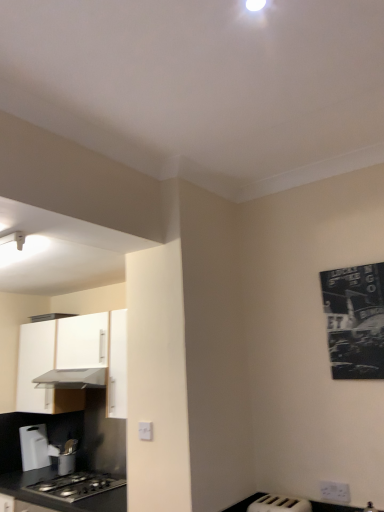
What do you see at coordinates (72, 379) in the screenshot? I see `metallic gray exhaust hood at left` at bounding box center [72, 379].

Find the location of `metallic gray exhaust hood at left`. metallic gray exhaust hood at left is located at coordinates (72, 379).

The image size is (384, 512). Describe the element at coordinates (72, 361) in the screenshot. I see `white matte cabinet at left` at that location.

Identify the location of white plastic cutting board at lower left. The image size is (384, 512). (34, 447).

The height and width of the screenshot is (512, 384). In order to click on metallic silver utensil holder at lower left, the second appliance when ordered from top to bottom in this screenshot , I will do `click(65, 456)`.

Where is `white plastic toaster at lower right, the 1th appliance viewed from the top`? This screenshot has height=512, width=384. white plastic toaster at lower right, the 1th appliance viewed from the top is located at coordinates (279, 504).

What is the approximate height of black paper poster at upper right?

black paper poster at upper right is 60.69 centimeters in height.

The height and width of the screenshot is (512, 384). Find the location of `black matte countertop at lower left`. black matte countertop at lower left is located at coordinates (61, 499).

Is white plastic electric outlet at lower center, arranged as the 1th electric outlet when viewed from the top, wider than white plastic toaster at lower right, the 2th appliance when ordered from bottom to top?

In fact, white plastic electric outlet at lower center, arranged as the 1th electric outlet when viewed from the top, might be narrower than white plastic toaster at lower right, the 2th appliance when ordered from bottom to top.

From a real-world perspective, count 2nd appliances downward from the white plastic electric outlet at lower center, positioned as the 1th electric outlet in left-to-right order, and point to it. Please provide its 2D coordinates.

[(279, 504)]

Does white plastic electric outlet at lower center, positioned as the 1th electric outlet in left-to-right order, turn towards white plastic toaster at lower right, the first appliance positioned from the front?

No, white plastic electric outlet at lower center, positioned as the 1th electric outlet in left-to-right order, is not turned towards white plastic toaster at lower right, the first appliance positioned from the front.

From a real-world perspective, is black matte countertop at lower left above or below black paper poster at upper right?

black matte countertop at lower left is below black paper poster at upper right.

Does black matte countertop at lower left turn towards black paper poster at upper right?

No, black matte countertop at lower left does not turn towards black paper poster at upper right.

Looking at this image, from the image's perspective, is black matte countertop at lower left positioned above or below black paper poster at upper right?

Based on their image positions, black matte countertop at lower left is located beneath black paper poster at upper right.

Which of these two, black matte countertop at lower left or black paper poster at upper right, is smaller?

black paper poster at upper right is smaller.

Is black matte countertop at lower left turned away from metallic gray exhaust hood at left?

black matte countertop at lower left is not turned away from metallic gray exhaust hood at left.

Is point (72, 509) behind point (104, 369)?

That is False.

You are a GUI agent. You are given a task and a screenshot of the screen. Output one action in this format:
    pyautogui.click(x=<x>, y=<y>)
    Task: Click on the exhaust hood lying above the black matte countertop at lower left (from the image's perspective)
    The height and width of the screenshot is (512, 384).
    Given the screenshot: What is the action you would take?
    pyautogui.click(x=72, y=379)

Based on the photo, does black matte countertop at lower left have a greater width compared to metallic gray exhaust hood at left?

Correct, the width of black matte countertop at lower left exceeds that of metallic gray exhaust hood at left.

In the image, is white plastic cutting board at lower left on the left side or the right side of white plastic electric outlet at lower center, which ranks as the 2th electric outlet in right-to-left order?

From the image, it's evident that white plastic cutting board at lower left is to the left of white plastic electric outlet at lower center, which ranks as the 2th electric outlet in right-to-left order.

Is white plastic cutting board at lower left taller or shorter than white plastic electric outlet at lower center, arranged as the 1th electric outlet when viewed from the top?

Considering their sizes, white plastic cutting board at lower left has more height than white plastic electric outlet at lower center, arranged as the 1th electric outlet when viewed from the top.

From the image's perspective, is white plastic cutting board at lower left positioned above or below white plastic electric outlet at lower center, arranged as the 1th electric outlet when viewed from the top?

white plastic cutting board at lower left is below white plastic electric outlet at lower center, arranged as the 1th electric outlet when viewed from the top.

Does point (70, 464) come farther from viewer compared to point (89, 316)?

Yes, it is behind point (89, 316).

Does metallic silver utensil holder at lower left, which ranks as the first appliance in back-to-front order, have a larger size compared to white matte cabinet at left?

No, metallic silver utensil holder at lower left, which ranks as the first appliance in back-to-front order, is not bigger than white matte cabinet at left.

Is metallic silver utensil holder at lower left, which ranks as the second appliance in front-to-back order, in front of or behind white matte cabinet at left in the image?

Visually, metallic silver utensil holder at lower left, which ranks as the second appliance in front-to-back order, is located behind white matte cabinet at left.

The width and height of the screenshot is (384, 512). There is a metallic gray exhaust hood at left. In order to click on the 1st electric outlet below it (from a real-world perspective) in this screenshot , I will do `click(146, 431)`.

Could you tell me if metallic gray exhaust hood at left is facing white plastic electric outlet at lower center, positioned as the 1th electric outlet in left-to-right order?

No.

Can you tell me how much metallic gray exhaust hood at left and white plastic electric outlet at lower center, which ranks as the 2th electric outlet in right-to-left order, differ in facing direction?

The angular difference between metallic gray exhaust hood at left and white plastic electric outlet at lower center, which ranks as the 2th electric outlet in right-to-left order, is 0.616 degrees.

Which object is further away from the camera taking this photo, metallic gray exhaust hood at left or white plastic electric outlet at lower center, arranged as the 1th electric outlet when viewed from the top?

metallic gray exhaust hood at left is behind.

Is the position of black matte countertop at lower left less distant than that of white plastic electric outlet at lower center, positioned as the 1th electric outlet in left-to-right order?

That is False.

From the image's perspective, who appears lower, black matte countertop at lower left or white plastic electric outlet at lower center, positioned as the 1th electric outlet in left-to-right order?

black matte countertop at lower left.

Who is shorter, black matte countertop at lower left or white plastic electric outlet at lower center, positioned as the 1th electric outlet in left-to-right order?

black matte countertop at lower left is shorter.

Is point (2, 478) more distant than point (149, 431)?

Yes, it is.

The image size is (384, 512). In order to click on the 2nd appliance positioned below the white plastic electric outlet at lower center, which ranks as the 2th electric outlet in bottom-to-top order (from a real-world perspective) in this screenshot , I will do `click(279, 504)`.

Where is `picture frame that is above the black matte countertop at lower left (from a real-world perspective)`? Image resolution: width=384 pixels, height=512 pixels. picture frame that is above the black matte countertop at lower left (from a real-world perspective) is located at coordinates (355, 320).

Looking at the image, which one is located further to white plastic electric outlet at lower center, arranged as the 1th electric outlet when viewed from the top, black paper poster at upper right or metallic gray exhaust hood at left?

The object further to white plastic electric outlet at lower center, arranged as the 1th electric outlet when viewed from the top, is black paper poster at upper right.

Estimate the real-world distances between objects in this image. Which object is further from metallic silver utensil holder at lower left, which ranks as the 1th appliance in left-to-right order, white plastic cutting board at lower left or metallic gray exhaust hood at left?

metallic gray exhaust hood at left is positioned further to the anchor metallic silver utensil holder at lower left, which ranks as the 1th appliance in left-to-right order.

Looking at the image, which one is located further to white plastic cutting board at lower left, metallic silver utensil holder at lower left, which ranks as the 1th appliance in left-to-right order, or black matte countertop at lower left?

Among the two, black matte countertop at lower left is located further to white plastic cutting board at lower left.

Considering their positions, is white plastic toaster at lower right, which appears as the first appliance when viewed from the right, positioned further to white plastic electric outlet at lower right, which is the 1th electric outlet in bottom-to-top order, than metallic gray exhaust hood at left?

Based on the image, metallic gray exhaust hood at left appears to be further to white plastic electric outlet at lower right, which is the 1th electric outlet in bottom-to-top order.

Considering their positions, is metallic gray exhaust hood at left positioned further to black matte countertop at lower left than metallic silver utensil holder at lower left, which ranks as the first appliance in back-to-front order?

metallic gray exhaust hood at left is positioned further to the anchor black matte countertop at lower left.

When comparing their distances from white plastic cutting board at lower left, does black paper poster at upper right or white matte cabinet at left seem further?

Based on the image, black paper poster at upper right appears to be further to white plastic cutting board at lower left.

From the image, which object appears to be farther from white plastic toaster at lower right, which appears as the first appliance when viewed from the right, white plastic cutting board at lower left or white plastic electric outlet at lower right, which is the 1th electric outlet in bottom-to-top order?

Based on the image, white plastic cutting board at lower left appears to be further to white plastic toaster at lower right, which appears as the first appliance when viewed from the right.

Which object lies further to the anchor point white plastic cutting board at lower left, metallic gray exhaust hood at left or black paper poster at upper right?

black paper poster at upper right is further to white plastic cutting board at lower left.

I want to click on appliance between white matte cabinet at left and white plastic electric outlet at lower right, the second electric outlet in the top-to-bottom sequence, from left to right, so 279,504.

Where is `exhaust hood situated between metallic silver utensil holder at lower left, which ranks as the first appliance in back-to-front order, and white plastic electric outlet at lower right, which is the 1th electric outlet in bottom-to-top order, from left to right`? This screenshot has height=512, width=384. exhaust hood situated between metallic silver utensil holder at lower left, which ranks as the first appliance in back-to-front order, and white plastic electric outlet at lower right, which is the 1th electric outlet in bottom-to-top order, from left to right is located at coordinates (72, 379).

Locate an element on the screen. This screenshot has height=512, width=384. appliance located between black matte countertop at lower left and black paper poster at upper right in the left-right direction is located at coordinates (279, 504).

Identify the location of appliance between white plastic electric outlet at lower center, which ranks as the 2th electric outlet in bottom-to-top order, and black paper poster at upper right from left to right. This screenshot has height=512, width=384. (279, 504).